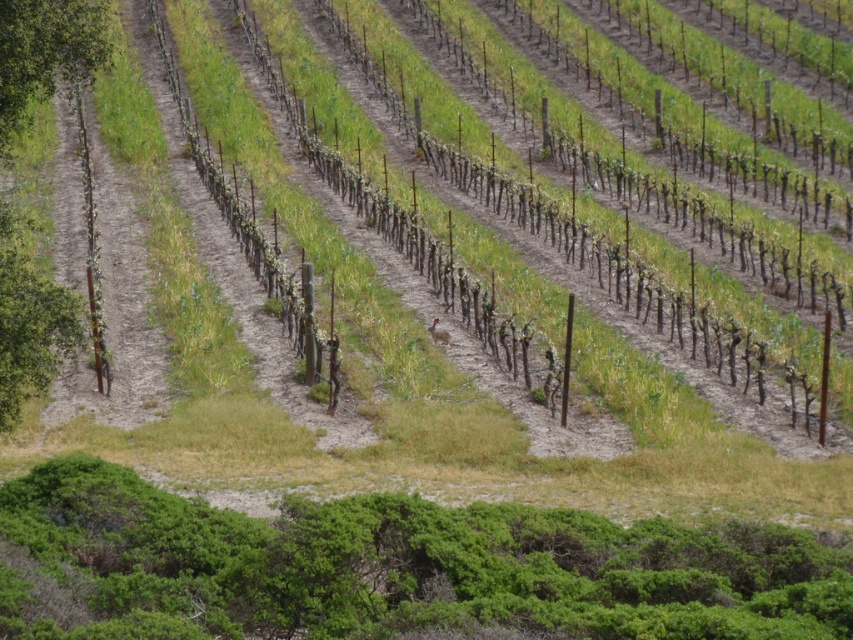
Question: Which of the following is the farthest from the observer?

Choices:
 (A) (12, 6)
 (B) (15, 240)

Answer: (B)

Question: Which object is closer to the camera taking this photo?

Choices:
 (A) smooth brown tree trunk at left
 (B) green leafy tree at upper left

Answer: (A)

Question: Can you confirm if smooth brown tree trunk at left is bigger than green leafy tree at upper left?

Choices:
 (A) yes
 (B) no

Answer: (A)

Question: Does smooth brown tree trunk at left have a larger size compared to green leafy tree at upper left?

Choices:
 (A) yes
 (B) no

Answer: (A)

Question: Can you confirm if smooth brown tree trunk at left is smaller than green leafy tree at upper left?

Choices:
 (A) yes
 (B) no

Answer: (B)

Question: Which of the following is the farthest from the observer?

Choices:
 (A) pyautogui.click(x=48, y=320)
 (B) pyautogui.click(x=26, y=10)

Answer: (A)